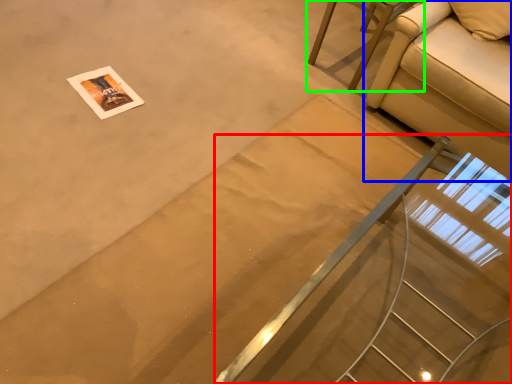
Question: Which is farther away from stairs (highlighted by a red box)? studio couch (highlighted by a blue box) or furniture (highlighted by a green box)?

Choices:
 (A) studio couch
 (B) furniture

Answer: (B)